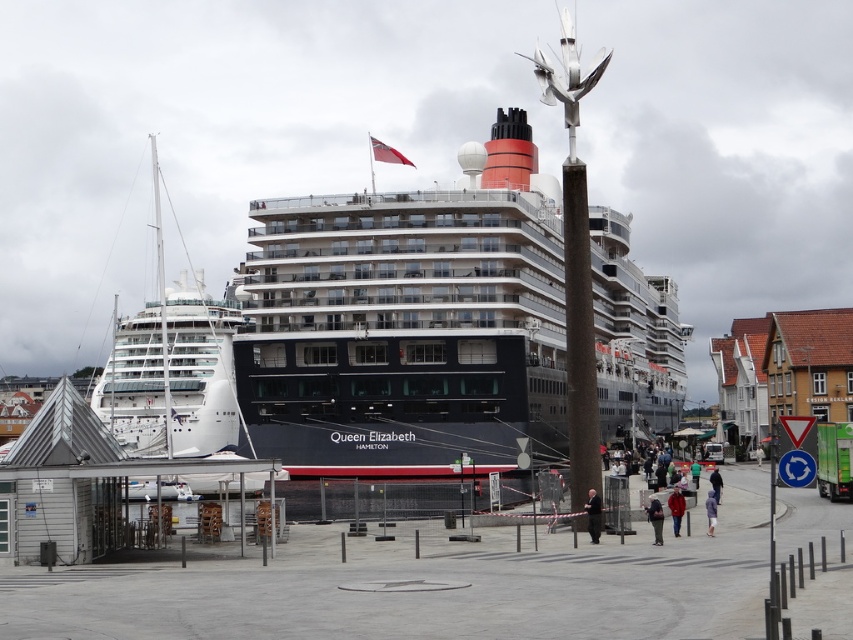
Question: Can you confirm if white glossy cruise ship at left is smaller than purple fabric jacket at lower center?

Choices:
 (A) no
 (B) yes

Answer: (A)

Question: Which object is positioned closest to the green fabric jacket at lower center?

Choices:
 (A) purple fabric jacket at lower center
 (B) dark green pants at center

Answer: (A)

Question: Is white glossy cruise ship at left above dark gray suit at center?

Choices:
 (A) no
 (B) yes

Answer: (B)

Question: Among these points, which one is farthest from the camera?

Choices:
 (A) (672, 490)
 (B) (712, 534)
 (C) (698, 465)

Answer: (C)

Question: Considering the real-world distances, which object is farthest from the dark gray suit at center?

Choices:
 (A) red fleece jacket at center
 (B) white glossy cruise ship at left

Answer: (B)

Question: Is dark green pants at center positioned in front of purple fabric jacket at lower center?

Choices:
 (A) yes
 (B) no

Answer: (A)